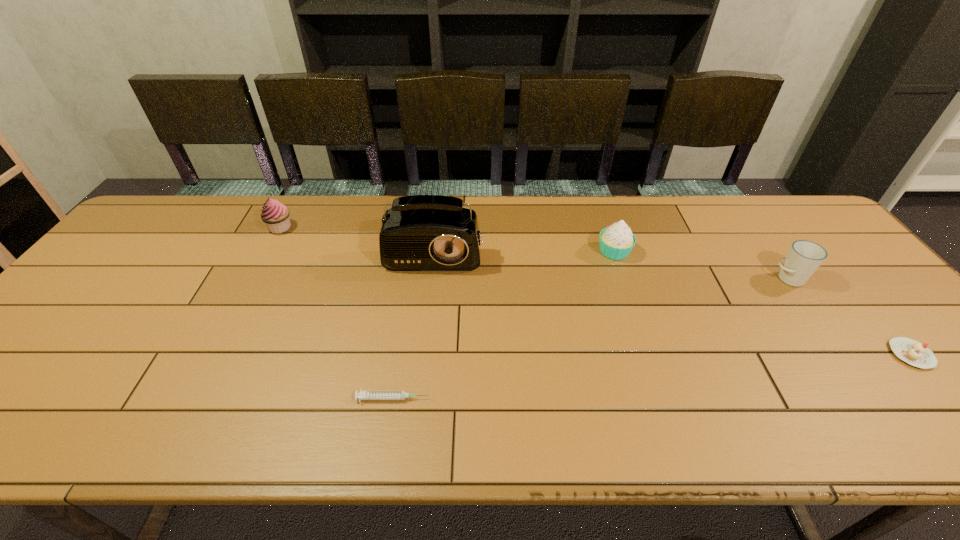
Find the location of `empty location between the second nearest object and the tallest object`. empty location between the second nearest object and the tallest object is located at coordinates (674, 297).

I want to click on vacant space in between the radio receiver and the second cupcake from right to left, so click(525, 246).

At what (x,y) coordinates should I click in order to perform the action: click on free area in between the second object from right to left and the shortest object. Please return your answer as a coordinate pair (x, y). This screenshot has width=960, height=540. Looking at the image, I should click on (590, 339).

Locate which object is the closest to the nearest object. Please provide its 2D coordinates. Your answer should be formatted as a tuple, i.e. [(x, y)], where the tuple contains the x and y coordinates of a point satisfying the conditions above.

[(420, 232)]

Image resolution: width=960 pixels, height=540 pixels. What are the coordinates of `object that is the second closest to the rightmost cupcake` in the screenshot? It's located at (616, 242).

You are a GUI agent. You are given a task and a screenshot of the screen. Output one action in this format:
    pyautogui.click(x=<x>, y=<y>)
    Task: Click on the cupcake that is the closest to the shortest cupcake
    
    Given the screenshot: What is the action you would take?
    pyautogui.click(x=616, y=242)

Identify which cupcake is located as the nearest to the fourth object from left to right. Please provide its 2D coordinates. Your answer should be formatted as a tuple, i.e. [(x, y)], where the tuple contains the x and y coordinates of a point satisfying the conditions above.

[(912, 352)]

Find the location of `vacant space that satisfies the following two spatial constraints: 1. on the front-facing side of the radio receiver; 2. on the right side of the nearest cupcake`. vacant space that satisfies the following two spatial constraints: 1. on the front-facing side of the radio receiver; 2. on the right side of the nearest cupcake is located at coordinates (423, 354).